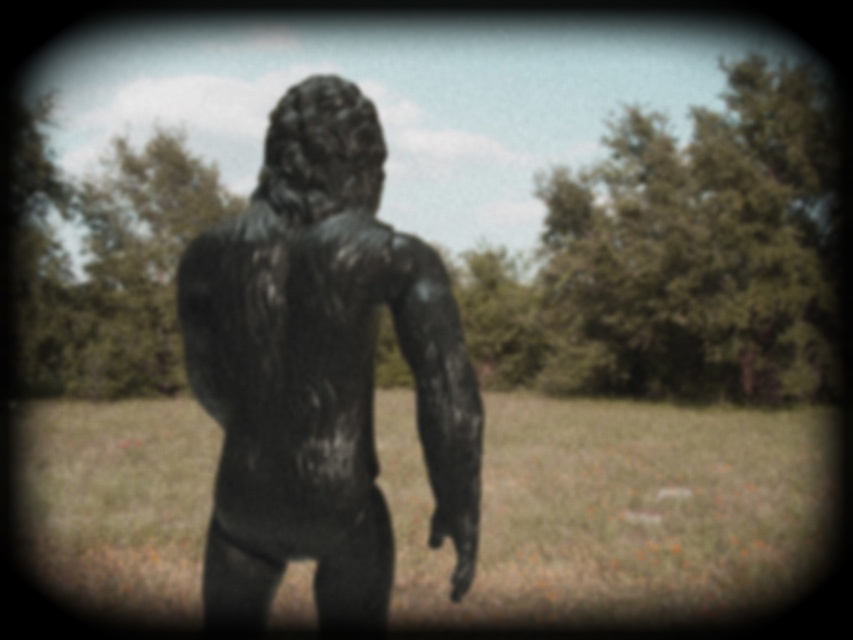
Question: Which point is closer to the camera taking this photo?

Choices:
 (A) (267, 355)
 (B) (724, 477)

Answer: (A)

Question: Is green grass at center above black matte statue at center?

Choices:
 (A) yes
 (B) no

Answer: (B)

Question: Which point is closer to the camera taking this photo?

Choices:
 (A) (672, 525)
 (B) (248, 602)

Answer: (B)

Question: Can you confirm if green grass at center is positioned to the right of black matte statue at center?

Choices:
 (A) yes
 (B) no

Answer: (B)

Question: Can you confirm if green grass at center is thinner than black matte statue at center?

Choices:
 (A) yes
 (B) no

Answer: (B)

Question: Which point appears closest to the camera in this image?

Choices:
 (A) (369, 440)
 (B) (787, 461)

Answer: (A)